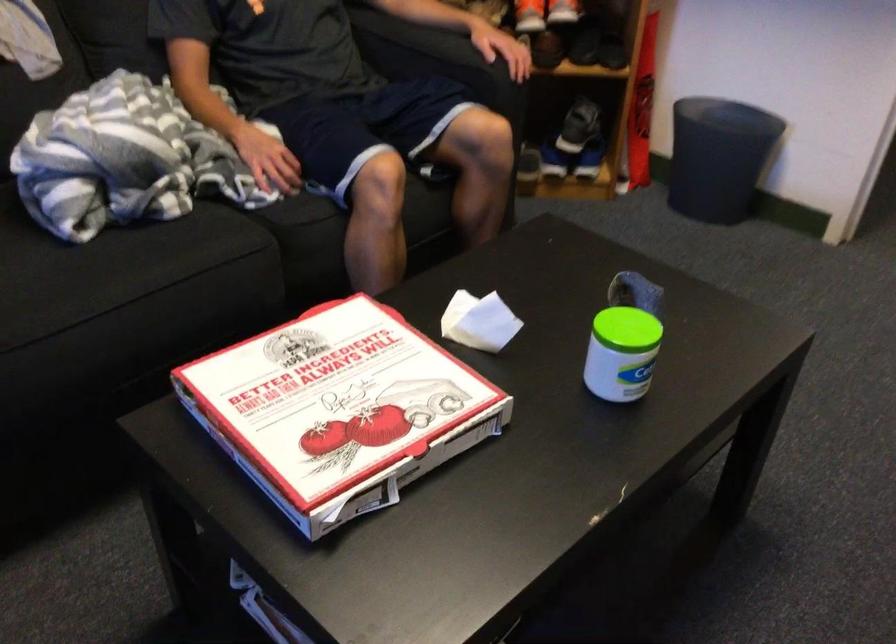
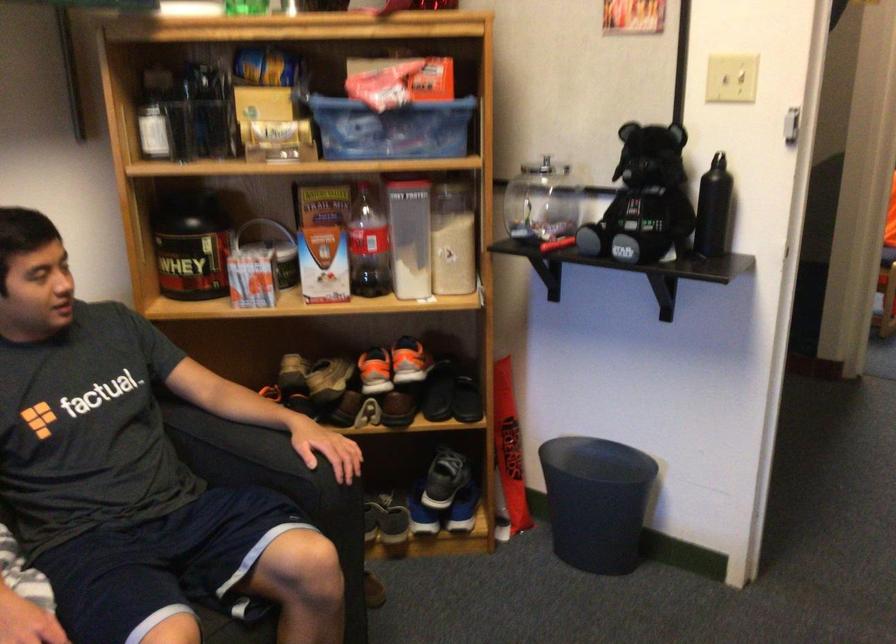
Where in the second image is the point corresponding to point 419,169 from the first image?

(237, 605)